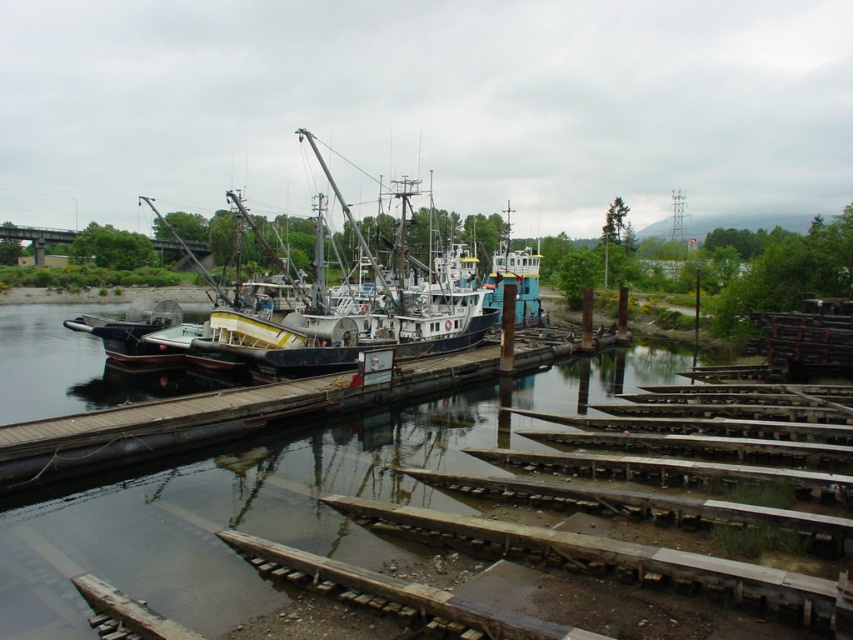
Which is above, transparent water at center or brushed metal boat at center?

brushed metal boat at center

Based on the photo, who is more forward, (273, 538) or (254, 346)?

Point (273, 538)

You are a GUI agent. You are given a task and a screenshot of the screen. Output one action in this format:
    pyautogui.click(x=<x>, y=<y>)
    Task: Click on the transparent water at center
    Image resolution: width=853 pixels, height=640 pixels.
    Given the screenshot: What is the action you would take?
    pyautogui.click(x=225, y=515)

Consider the image. Can you confirm if transparent water at center is positioned above wooden at center?

No, transparent water at center is not above wooden at center.

Does transparent water at center appear on the left side of wooden at center?

No, transparent water at center is not to the left of wooden at center.

Does point (293, 470) lie behind point (283, 397)?

No, (293, 470) is closer to viewer.

Where is `transparent water at center`? The height and width of the screenshot is (640, 853). transparent water at center is located at coordinates (225, 515).

Based on the photo, can you confirm if wooden at center is smaller than brushed metal boat at center?

Correct, wooden at center occupies less space than brushed metal boat at center.

Find the location of `wooden at center`. wooden at center is located at coordinates (212, 417).